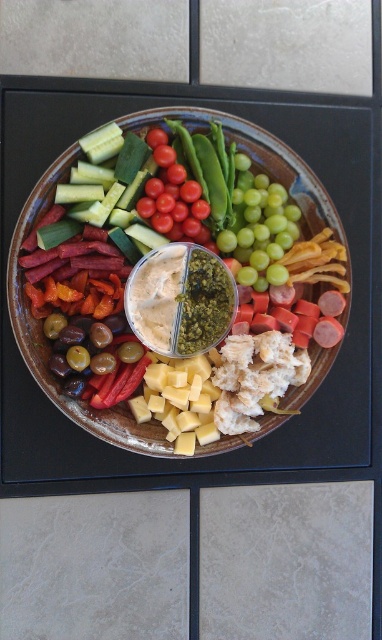
Does brown ceramic platter at center have a lesser height compared to red glossy cherry tomatoes at center?

No.

In the scene shown: Is brown ceramic platter at center wider than red glossy cherry tomatoes at center?

Yes.

Who is more forward, (289, 179) or (179, 141)?

Point (179, 141) is in front.

At what (x,y) coordinates should I click in order to perform the action: click on brown ceramic platter at center. Please return your answer as a coordinate pair (x, y). The image size is (382, 640). Looking at the image, I should click on (48, 346).

Can you confirm if smooth creamy dip at center is positioned to the right of red glossy cherry tomatoes at center?

Indeed, smooth creamy dip at center is positioned on the right side of red glossy cherry tomatoes at center.

Find the location of `smooth creamy dip at center`. smooth creamy dip at center is located at coordinates (181, 300).

The height and width of the screenshot is (640, 382). I want to click on smooth creamy dip at center, so click(x=181, y=300).

Does smooth creamy dip at center appear over yellow cube cheese at center?

Yes.

Can you confirm if smooth creamy dip at center is positioned to the right of yellow cube cheese at center?

Yes, smooth creamy dip at center is to the right of yellow cube cheese at center.

Identify the location of smooth creamy dip at center. The width and height of the screenshot is (382, 640). [181, 300].